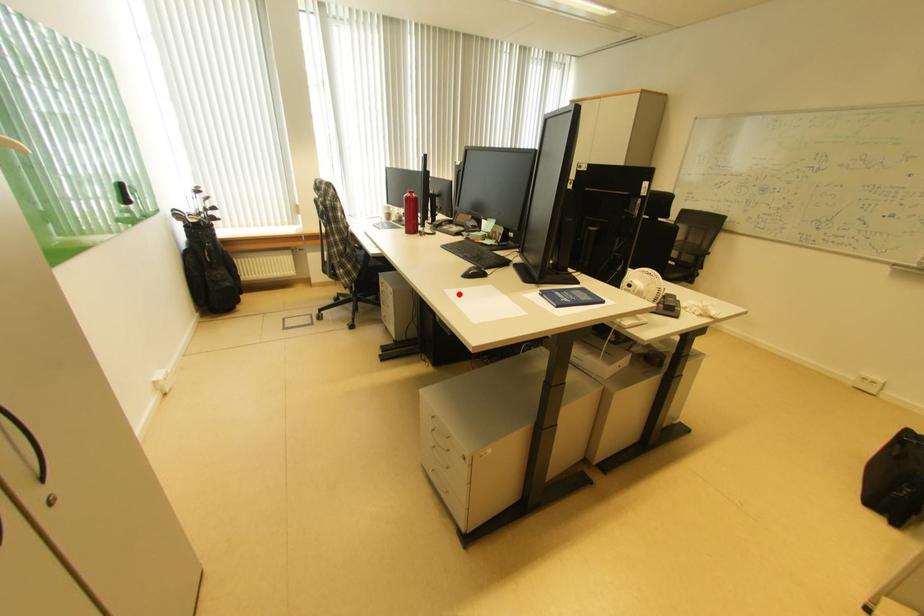
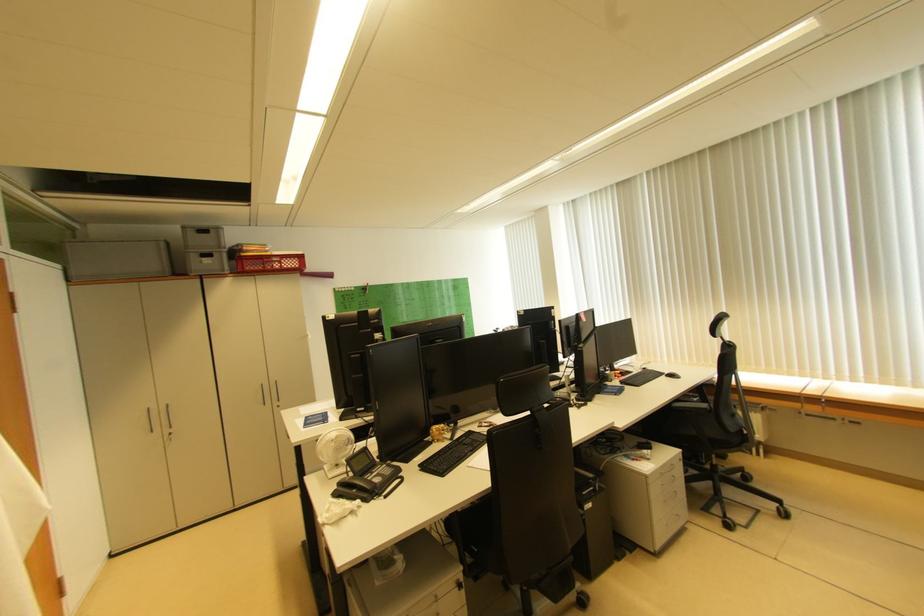
Question: I am providing you with two images of the same scene from different viewpoints. A red point is marked on the first image. Can you still see the location of the red point in image 2?

Choices:
 (A) Yes
 (B) No

Answer: (B)